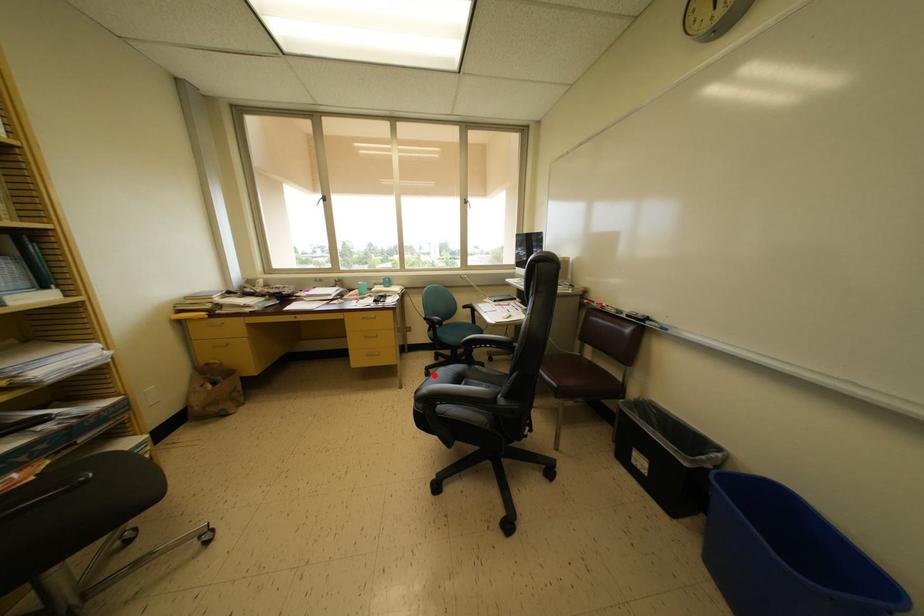
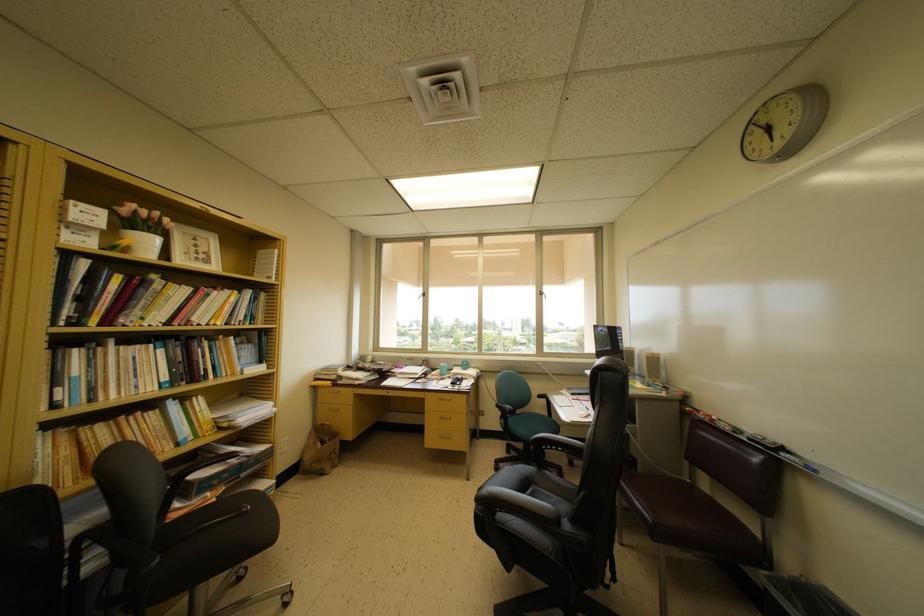
Question: I am providing you with two images of the same scene from different viewpoints. In image1, a red point is highlighted. Considering the same 3D point in image2, which of the following is correct?

Choices:
 (A) It is closer
 (B) It is farther

Answer: (B)